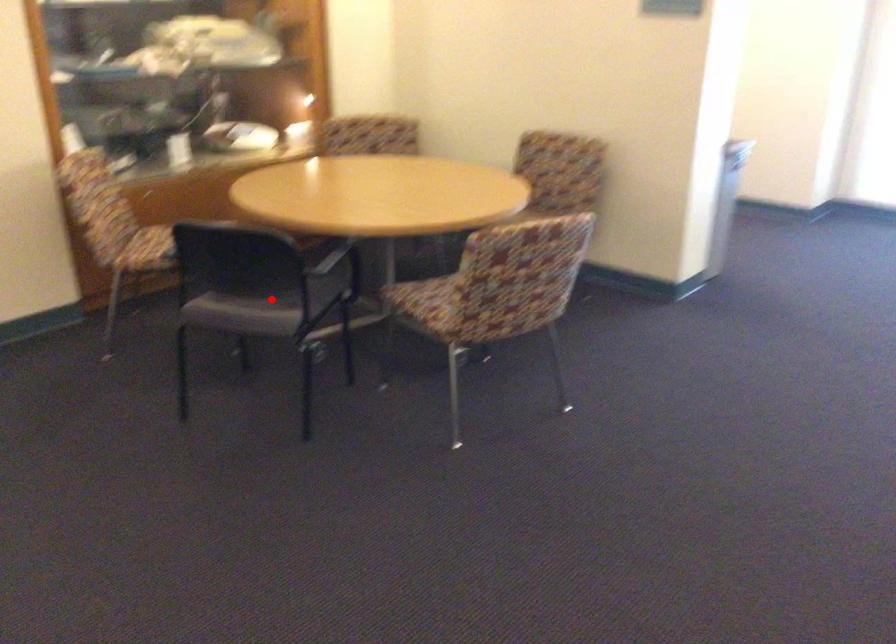
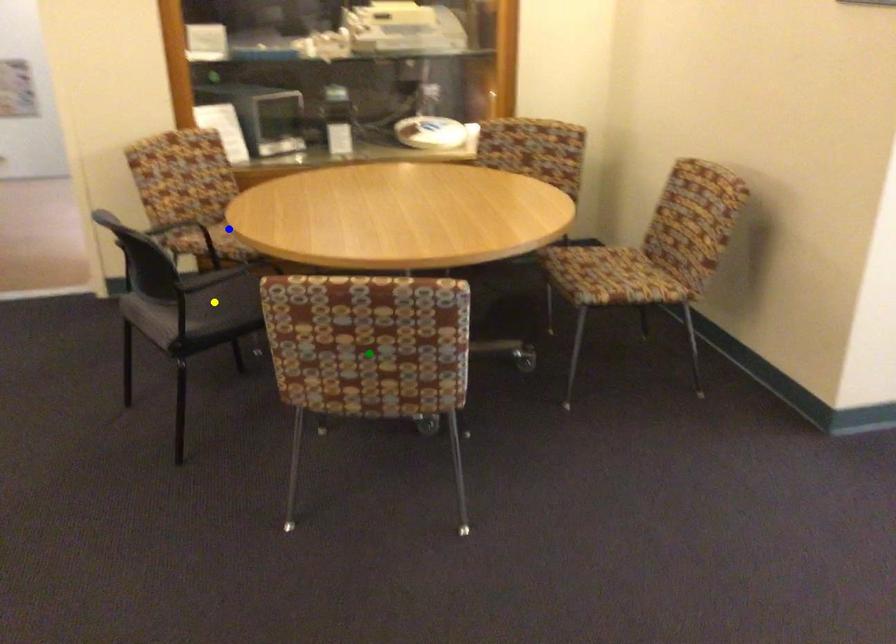
Question: I am providing you with two images of the same scene from different viewpoints. A red point is marked on the first image. You are given multiple points on the second image. Which point in image 2 is actually the same real-world point as the red point in image 1?

Choices:
 (A) yellow point
 (B) green point
 (C) blue point

Answer: (A)